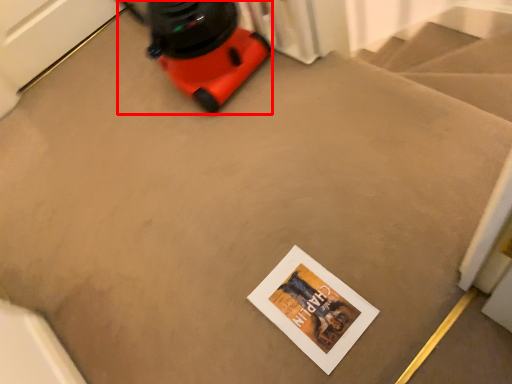
Question: Observing the image, what is the correct spatial positioning of equipment (annotated by the red box) in reference to postcard?

Choices:
 (A) right
 (B) left

Answer: (B)